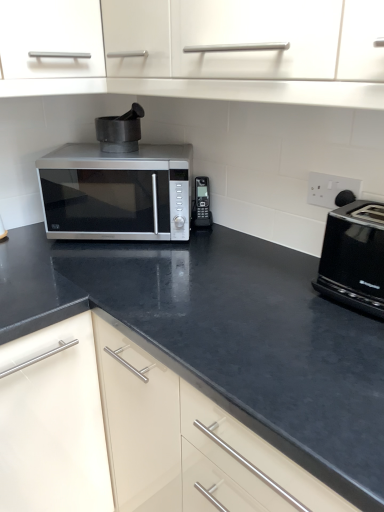
Question: Is white plastic electric outlet at upper right shorter than satin silver microwave at center?

Choices:
 (A) yes
 (B) no

Answer: (A)

Question: Does white plastic electric outlet at upper right appear on the right side of satin silver microwave at center?

Choices:
 (A) no
 (B) yes

Answer: (B)

Question: Can you confirm if white plastic electric outlet at upper right is bigger than satin silver microwave at center?

Choices:
 (A) no
 (B) yes

Answer: (A)

Question: Is the depth of white plastic electric outlet at upper right greater than that of satin silver microwave at center?

Choices:
 (A) no
 (B) yes

Answer: (A)

Question: Does white plastic electric outlet at upper right come in front of satin silver microwave at center?

Choices:
 (A) no
 (B) yes

Answer: (B)

Question: Is black plastic phone at center, the 2th appliance from the top, inside or outside of black plastic toaster at right?

Choices:
 (A) inside
 (B) outside

Answer: (B)

Question: Relative to black plastic toaster at right, is black plastic phone at center, the first appliance when ordered from bottom to top, in front or behind?

Choices:
 (A) behind
 (B) front

Answer: (A)

Question: From the image's perspective, is black plastic phone at center, which appears as the second appliance when viewed from the left, located above or below black plastic toaster at right?

Choices:
 (A) above
 (B) below

Answer: (A)

Question: In terms of size, does black plastic phone at center, the 2th appliance from the top, appear bigger or smaller than black plastic toaster at right?

Choices:
 (A) small
 (B) big

Answer: (A)

Question: In terms of size, does black plastic phone at center, the first appliance when ordered from bottom to top, appear bigger or smaller than satin silver microwave at center?

Choices:
 (A) small
 (B) big

Answer: (A)

Question: From the image's perspective, is black plastic phone at center, which appears as the second appliance when viewed from the left, above or below satin silver microwave at center?

Choices:
 (A) below
 (B) above

Answer: (A)

Question: Considering the positions of black plastic phone at center, the first appliance when ordered from bottom to top, and satin silver microwave at center in the image, is black plastic phone at center, the first appliance when ordered from bottom to top, taller or shorter than satin silver microwave at center?

Choices:
 (A) tall
 (B) short

Answer: (B)

Question: Considering the positions of point (195, 202) and point (155, 190), is point (195, 202) closer or farther from the camera than point (155, 190)?

Choices:
 (A) closer
 (B) farther

Answer: (B)

Question: Considering the positions of point (364, 289) and point (107, 145), is point (364, 289) closer or farther from the camera than point (107, 145)?

Choices:
 (A) farther
 (B) closer

Answer: (B)

Question: Considering the relative positions of black plastic toaster at right and black matte mortar at center, which is the second appliance in right-to-left order, in the image provided, is black plastic toaster at right to the left or to the right of black matte mortar at center, which is the second appliance in right-to-left order,?

Choices:
 (A) right
 (B) left

Answer: (A)